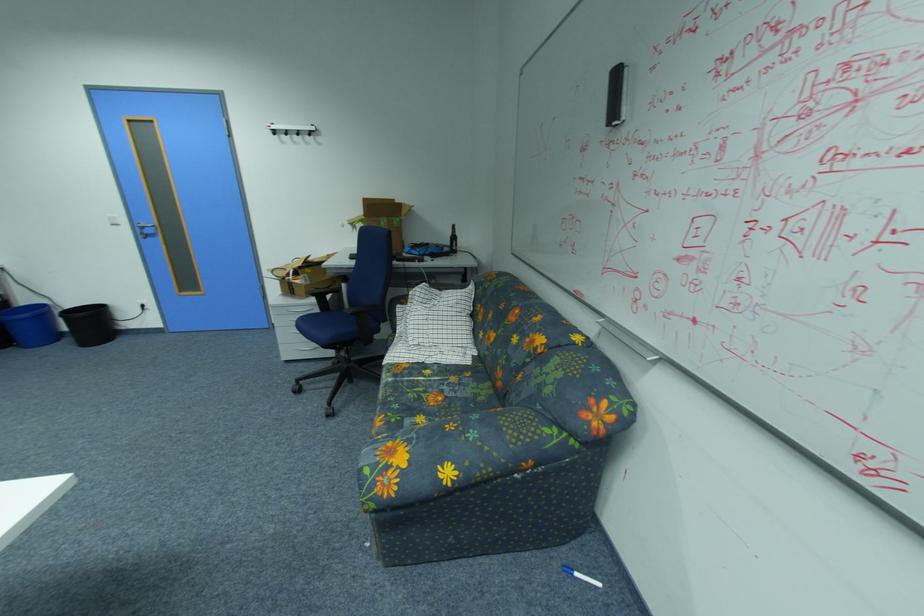
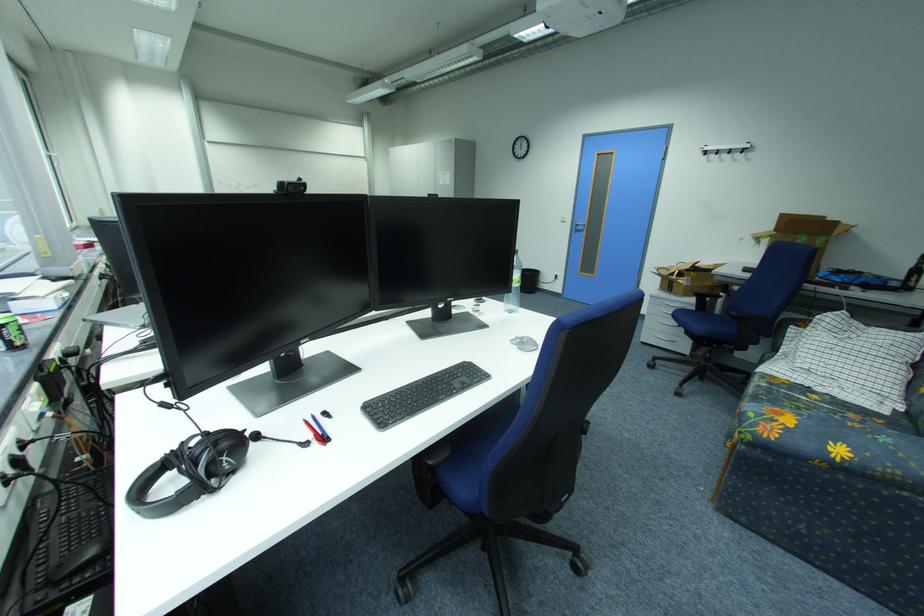
The point at (444, 379) is marked in the first image. Where is the corresponding point in the second image?

(834, 407)